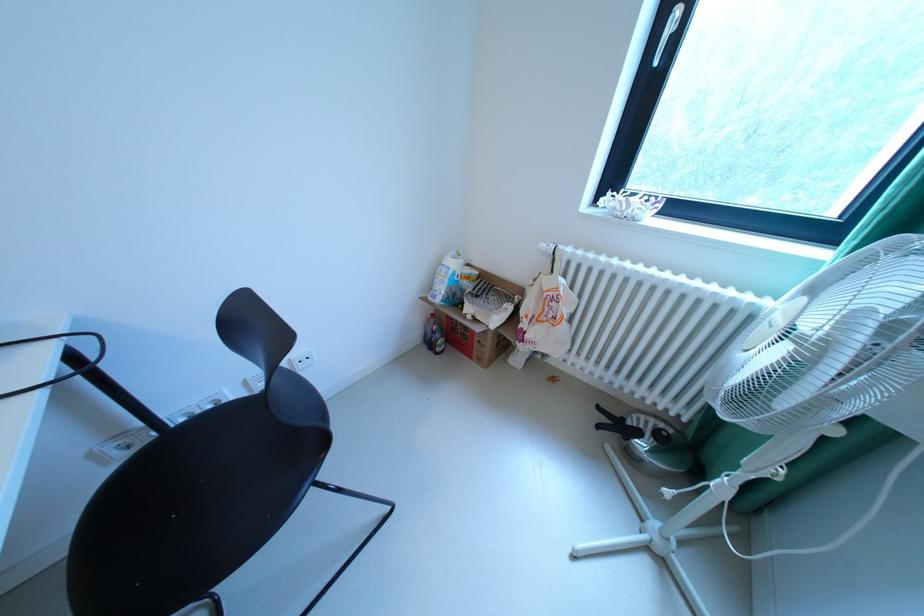
Image resolution: width=924 pixels, height=616 pixels. Find the location of `window handle`. window handle is located at coordinates (671, 25).